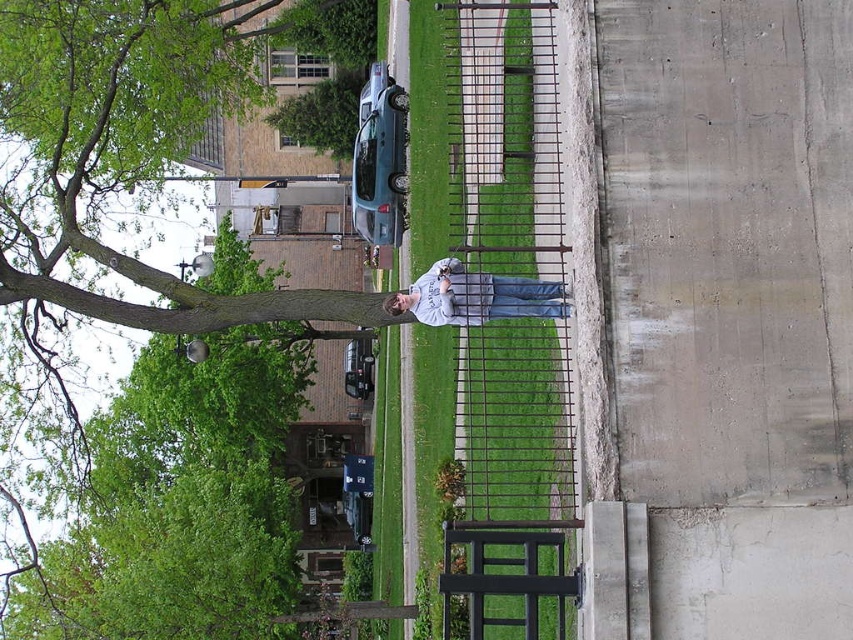
Can you confirm if green rough bark tree at upper left is positioned below teal matte car at center?

Yes, green rough bark tree at upper left is below teal matte car at center.

Which of these two, green rough bark tree at upper left or teal matte car at center, stands shorter?

With less height is teal matte car at center.

Is point (161, 12) more distant than point (395, 113)?

No.

Identify the location of green rough bark tree at upper left. This screenshot has height=640, width=853. (125, 148).

Is green rough bark tree at upper left to the right of light gray sweatshirt at center from the viewer's perspective?

No, green rough bark tree at upper left is not to the right of light gray sweatshirt at center.

Does green rough bark tree at upper left have a smaller size compared to light gray sweatshirt at center?

Incorrect, green rough bark tree at upper left is not smaller in size than light gray sweatshirt at center.

Identify the location of green rough bark tree at upper left. The height and width of the screenshot is (640, 853). (125, 148).

Locate an element on the screen. This screenshot has width=853, height=640. green rough bark tree at upper left is located at coordinates (125, 148).

Who is shorter, green grass at center or light gray sweatshirt at center?

With less height is light gray sweatshirt at center.

What do you see at coordinates (490, 314) in the screenshot? The image size is (853, 640). I see `green grass at center` at bounding box center [490, 314].

You are a GUI agent. You are given a task and a screenshot of the screen. Output one action in this format:
    pyautogui.click(x=<x>, y=<y>)
    Task: Click on the green grass at center
    This screenshot has width=853, height=640.
    Given the screenshot: What is the action you would take?
    pyautogui.click(x=490, y=314)